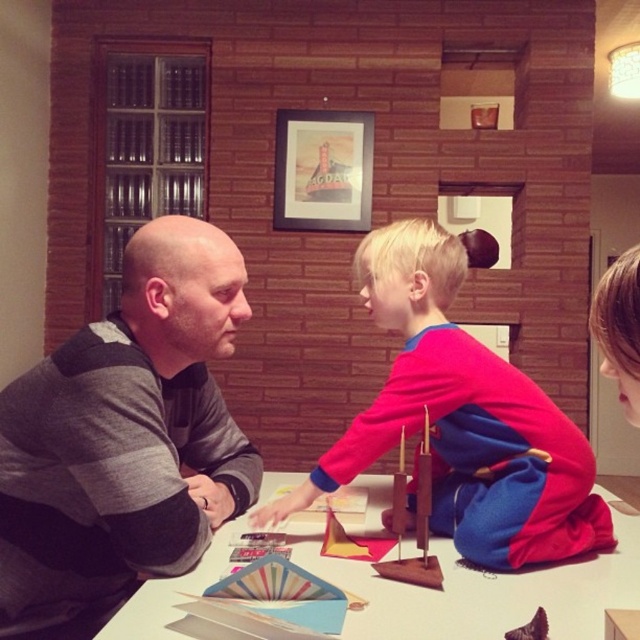
Question: Does gray sweater at left appear under wooden picture frame at upper center?

Choices:
 (A) no
 (B) yes

Answer: (B)

Question: Which point is closer to the camera?

Choices:
 (A) wooden model ship at center
 (B) wooden picture frame at upper center
 (C) gray sweater at left

Answer: (C)

Question: Considering the real-world distances, which object is farthest from the gray sweater at left?

Choices:
 (A) matte red and blue sweater at center
 (B) white glossy table at center
 (C) wooden model ship at center
 (D) wooden picture frame at upper center

Answer: (D)

Question: Which object is the closest to the gray sweater at left?

Choices:
 (A) matte red and blue sweater at center
 (B) white glossy table at center

Answer: (B)

Question: Does gray sweater at left come in front of wooden model ship at center?

Choices:
 (A) yes
 (B) no

Answer: (A)

Question: Can you confirm if white glossy table at center is positioned to the left of wooden picture frame at upper center?

Choices:
 (A) yes
 (B) no

Answer: (B)